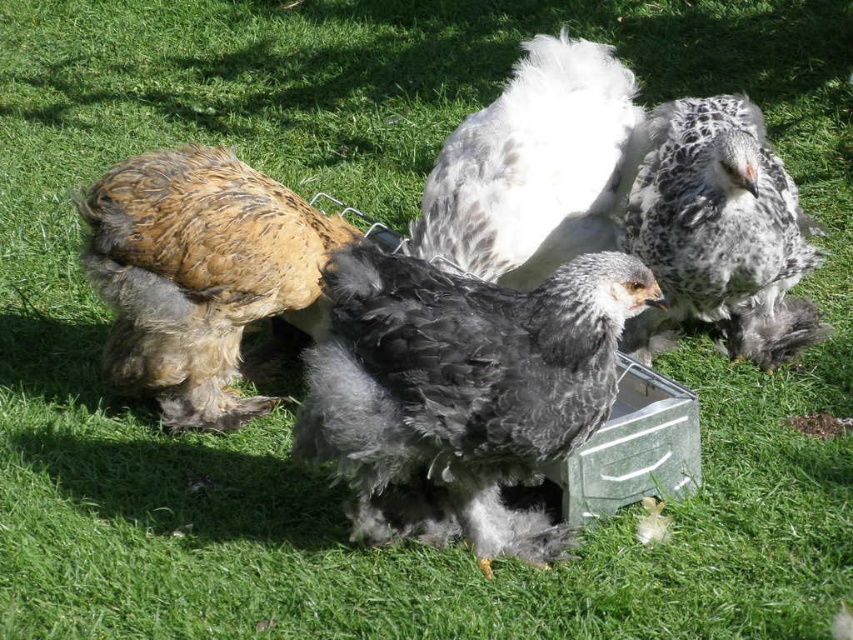
Consider the image. In the image of the chickens, where is the brown fluffy chicken at left relative to the white fluffy chicken at center?

The brown fluffy chicken at left is to the left of the white fluffy chicken at center.

You are a farmer observing the chickens in the image. You need to determine which chicken is taller between the brown fluffy chicken at left and the speckled feathered chicken at center right based on their positions in the image. Which one is taller?

The speckled feathered chicken at center right is taller than the brown fluffy chicken at left.